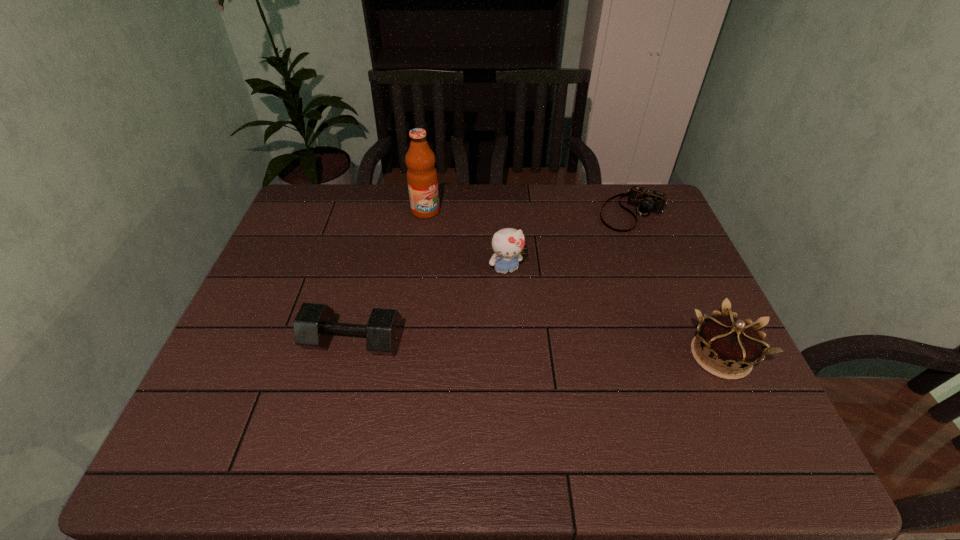
Locate an element on the screen. This screenshot has width=960, height=540. vacant space located on the front-facing side of the camera is located at coordinates (595, 263).

Locate an element on the screen. The width and height of the screenshot is (960, 540). vacant position located 0.330m on the front-facing side of the kitten is located at coordinates (552, 380).

The height and width of the screenshot is (540, 960). I want to click on free space located on the front-facing side of the kitten, so click(x=535, y=339).

What are the coordinates of `free location located on the front-facing side of the kitten` in the screenshot? It's located at (547, 369).

Identify the location of free space located on the front label of the fruit juice. (513, 286).

Find the location of a particular element. This screenshot has width=960, height=540. vacant area situated 0.160m on the front label of the fruit juice is located at coordinates (463, 243).

At what (x,y) coordinates should I click in order to perform the action: click on vacant space located on the front label of the fruit juice. Please return your answer as a coordinate pair (x, y). Image resolution: width=960 pixels, height=540 pixels. Looking at the image, I should click on (492, 268).

Locate an element on the screen. camera that is at the far edge is located at coordinates (645, 200).

You are a GUI agent. You are given a task and a screenshot of the screen. Output one action in this format:
    pyautogui.click(x=<x>, y=<y>)
    Task: Click on the fruit juice that is at the far edge
    The image size is (960, 540).
    Given the screenshot: What is the action you would take?
    pyautogui.click(x=422, y=179)

You are a GUI agent. You are given a task and a screenshot of the screen. Output one action in this format:
    pyautogui.click(x=<x>, y=<y>)
    Task: Click on the object that is positioned at the near edge
    
    Given the screenshot: What is the action you would take?
    pyautogui.click(x=726, y=341)